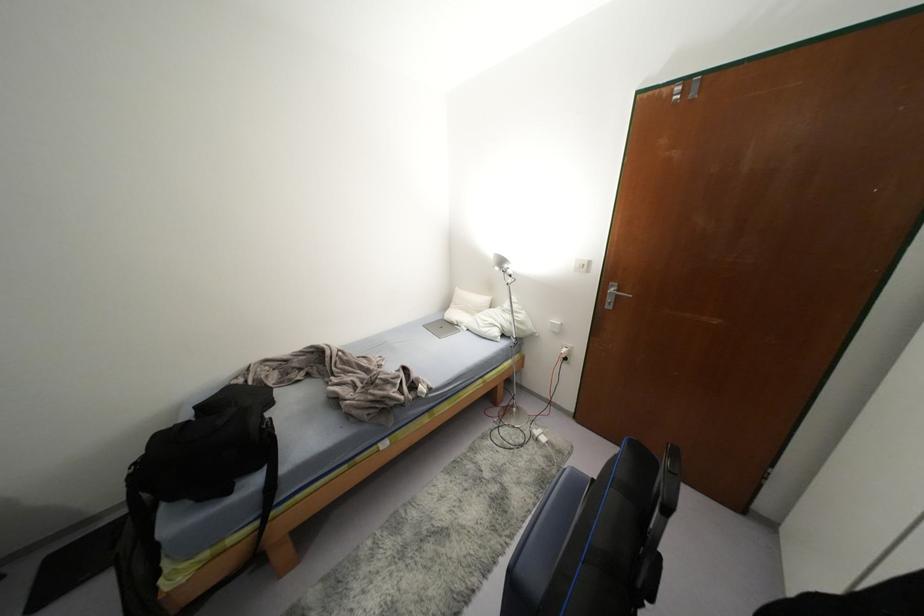
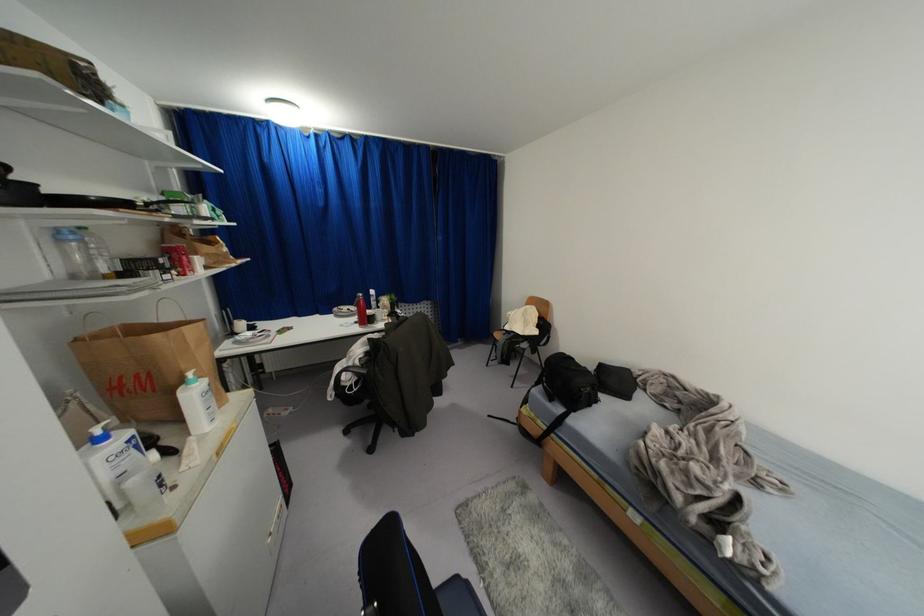
Based on the continuous images, in which direction is the camera rotating?

The camera rotated toward left-down.